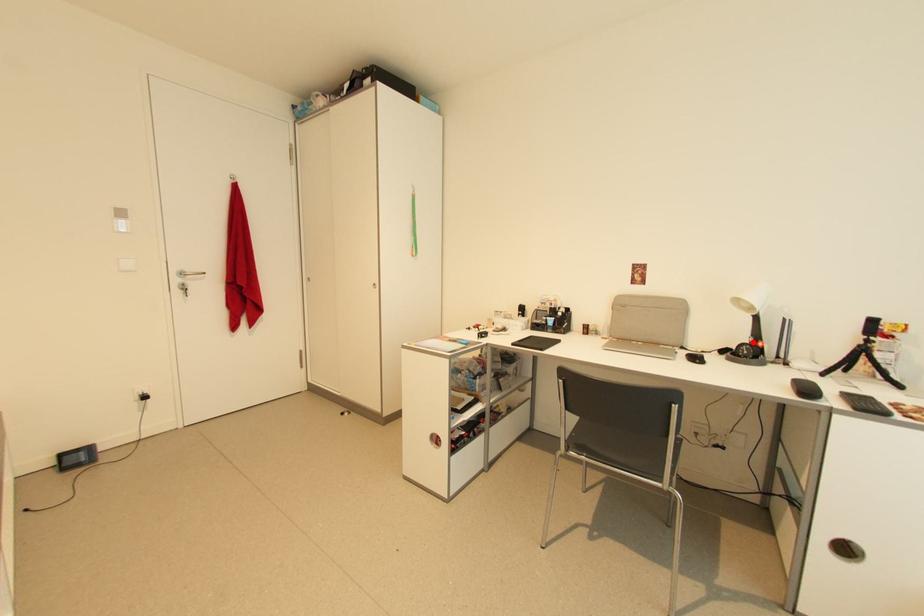
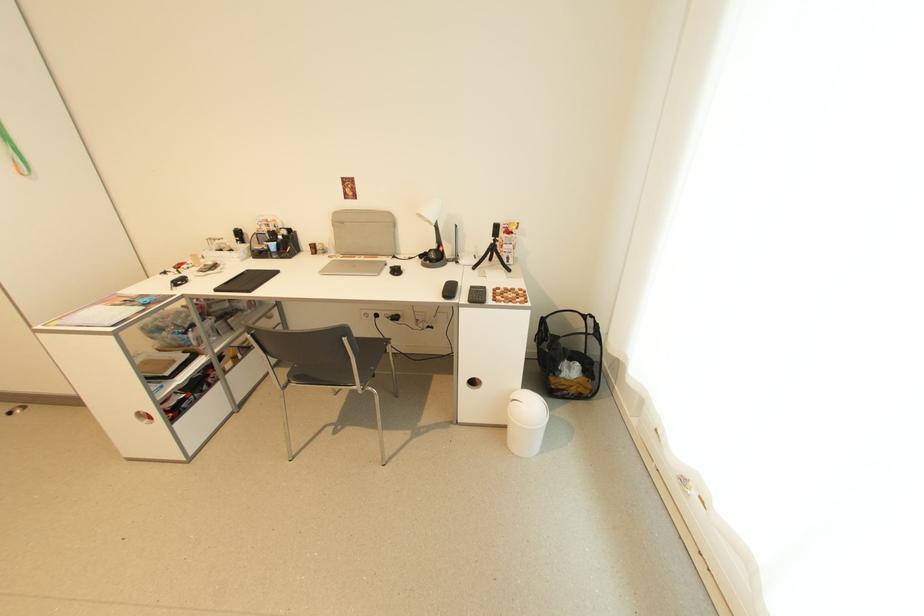
Where in the second image is the point corresponding to the highlighted location from the first image?

(439, 248)